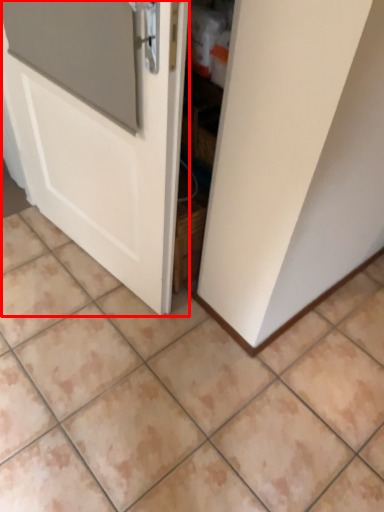
Question: Considering the relative positions of door (annotated by the red box) and ceramic tile in the image provided, where is door (annotated by the red box) located with respect to the staircase?

Choices:
 (A) left
 (B) right

Answer: (A)